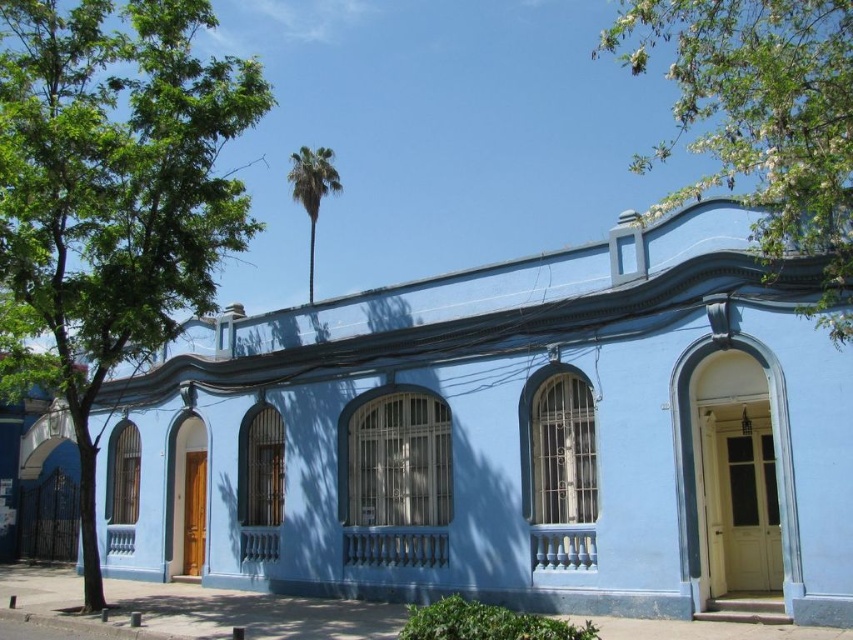
Describe the element at coordinates (762, 120) in the screenshot. The image size is (853, 640). I see `green leafy tree at upper right` at that location.

Who is positioned more to the left, green leafy tree at upper right or green leafy palm at upper center?

green leafy palm at upper center is more to the left.

Between point (630, 3) and point (308, 284), which one is positioned in front?

Positioned in front is point (630, 3).

Identify the location of green leafy tree at upper right. (762, 120).

Who is more forward, (119, 179) or (334, 182)?

Point (119, 179) is in front.

Who is positioned more to the left, green leafy tree at left or green leafy palm at upper center?

Positioned to the left is green leafy tree at left.

Where is `green leafy tree at left`? This screenshot has height=640, width=853. green leafy tree at left is located at coordinates (109, 196).

Locate an element on the screen. Image resolution: width=853 pixels, height=640 pixels. green leafy tree at left is located at coordinates (109, 196).

Who is positioned more to the right, green leafy tree at left or green leafy tree at upper right?

From the viewer's perspective, green leafy tree at upper right appears more on the right side.

Between green leafy tree at left and green leafy tree at upper right, which one has more height?

With more height is green leafy tree at left.

Is point (3, 70) less distant than point (766, 10)?

No, it is not.

Where is `green leafy tree at left`? green leafy tree at left is located at coordinates pos(109,196).